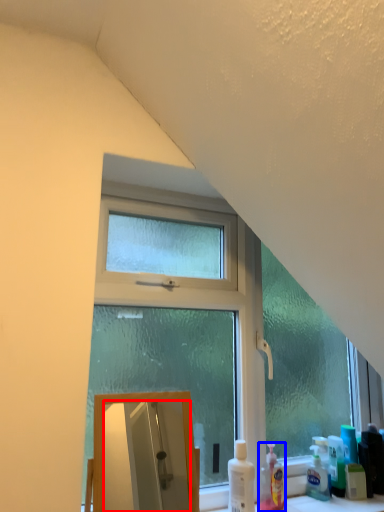
Question: Which object appears farthest to the camera in this image, mirror (highlighted by a red box) or cleaning product (highlighted by a blue box)?

Choices:
 (A) mirror
 (B) cleaning product

Answer: (B)